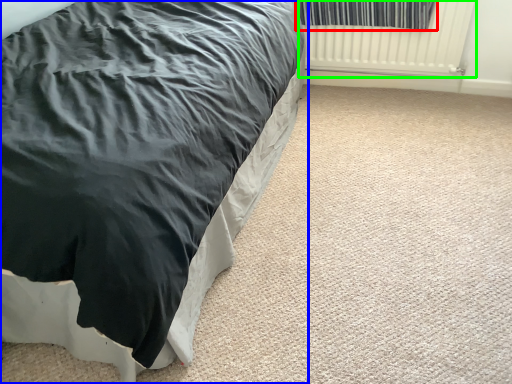
Question: Which object is the farthest from curtain (highlighted by a red box)? Choose among these: bed (highlighted by a blue box) or radiator (highlighted by a green box).

Choices:
 (A) bed
 (B) radiator

Answer: (A)